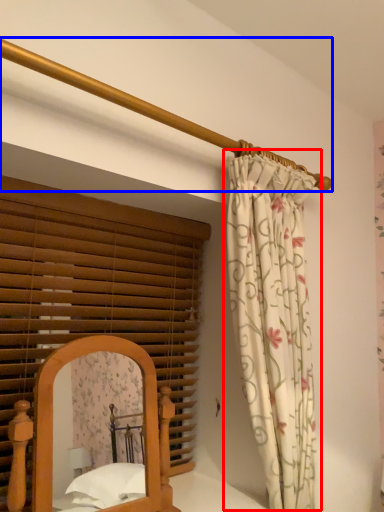
Question: Which object appears closest to the camera in this image, curtain (highlighted by a red box) or balustrade (highlighted by a blue box)?

Choices:
 (A) curtain
 (B) balustrade

Answer: (B)